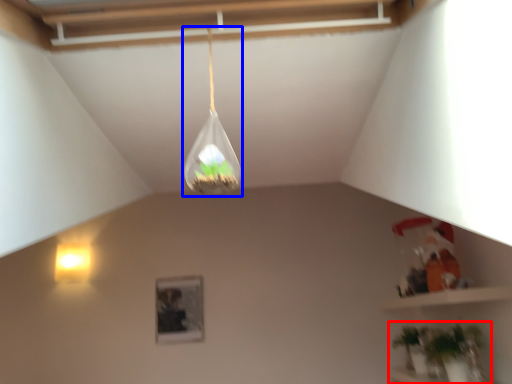
Question: Which object appears closest to the camera in this image, houseplant (highlighted by a red box) or lamp (highlighted by a blue box)?

Choices:
 (A) houseplant
 (B) lamp

Answer: (B)